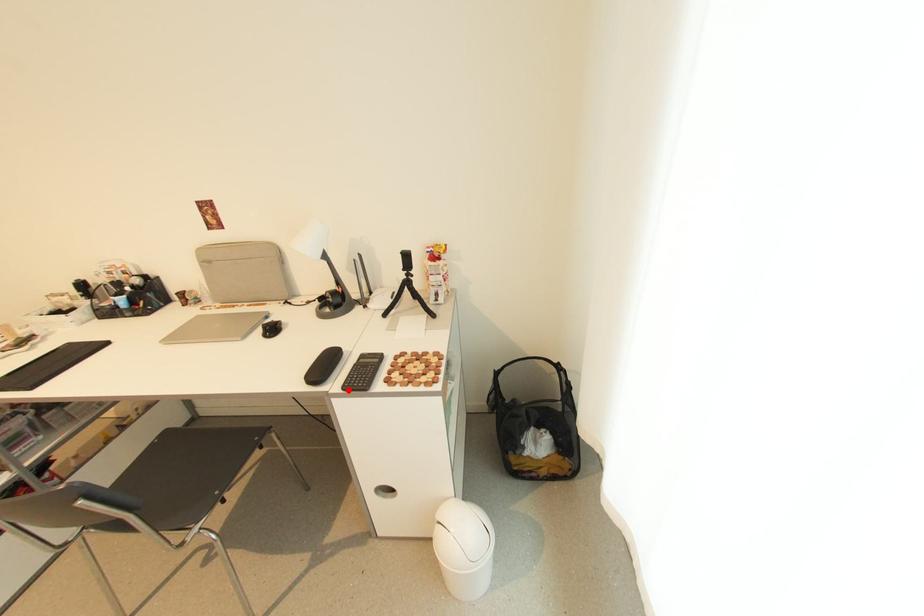
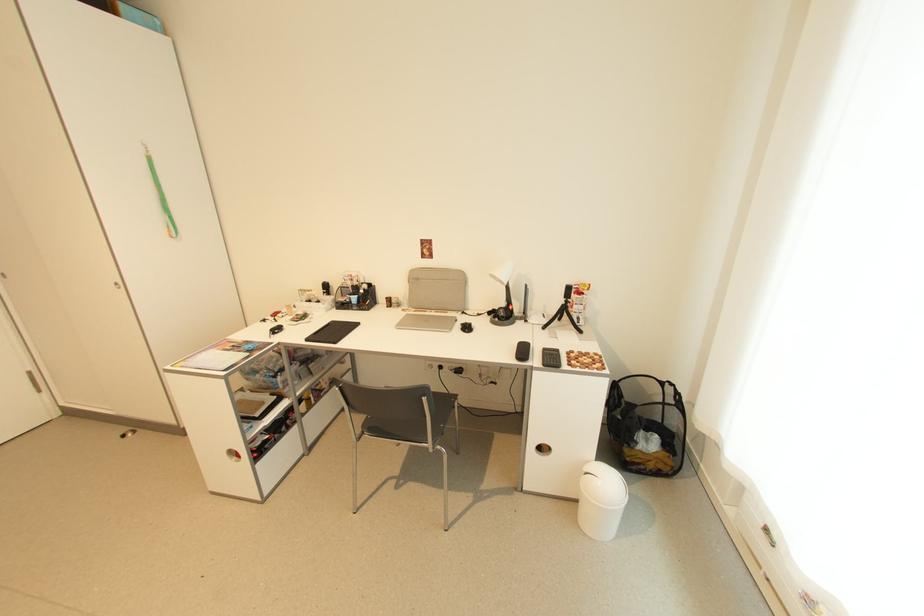
In the second image, find the point that corresponds to the highlighted location in the first image.

(548, 367)